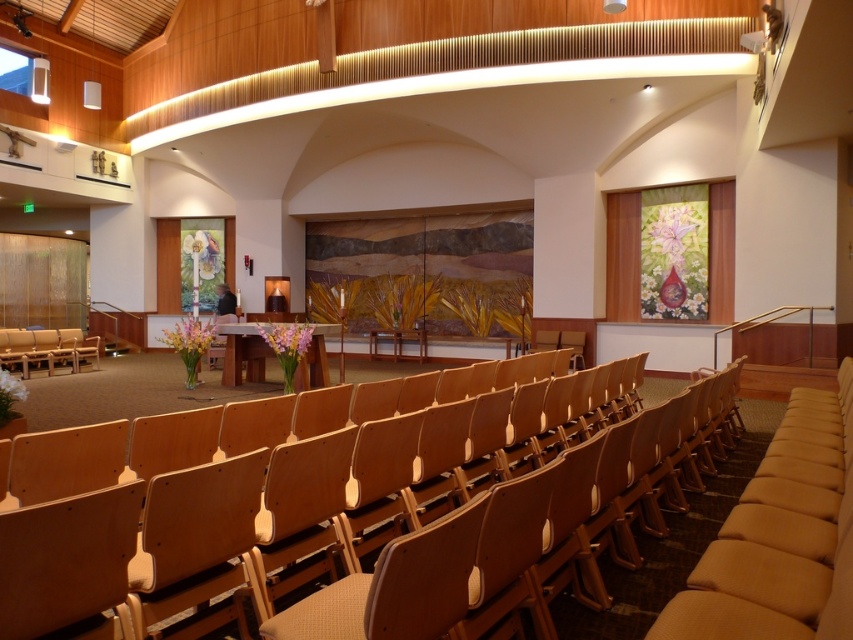
You are planning to set up a small stage for a performance in the modern church. The stage requires a minimum of 10 meters of space between the two light brown wood chairs. Based on the layout, will the space between the light brown wood chair at center and the light brown wood chair at left be sufficient?

The light brown wood chair at center is 12.33 meters from the light brown wood chair at left, which exceeds the required 10 meters. Therefore, the space between them is sufficient for the stage setup.

You are planning to set up a small table between the light brown wood chair at center and the light brown wood chair at left for a quiet reading corner. Considering their sizes, which chair should the table be placed closer to?

The light brown wood chair at center is larger in size than the light brown wood chair at left, so the table should be placed closer to the smaller light brown wood chair at left to ensure adequate space around both chairs.

You are planning to arrange a small event in the modern church and need to know seating capacity. If the light brown wood chair at center takes up more space than the light brown wood chair at left, how does this affect the total number of chairs that can fit in the area?

The light brown wood chair at center is wider than the light brown wood chair at left. Since the center chair requires more space, using more of these would reduce the total number of chairs that can fit in the area compared to using the narrower left chairs.